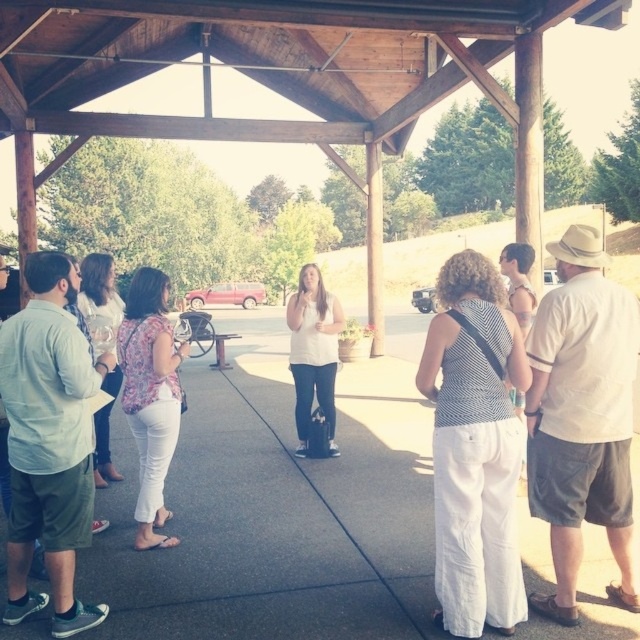
Is point (141, 362) positioned in front of point (324, 332)?

Yes, it is.

Is floral fabric blouse at center taller than white matte shirt at center?

Correct, floral fabric blouse at center is much taller as white matte shirt at center.

The height and width of the screenshot is (640, 640). Identify the location of floral fabric blouse at center. (150, 396).

Where is `floral fabric blouse at center`? This screenshot has width=640, height=640. floral fabric blouse at center is located at coordinates (150, 396).